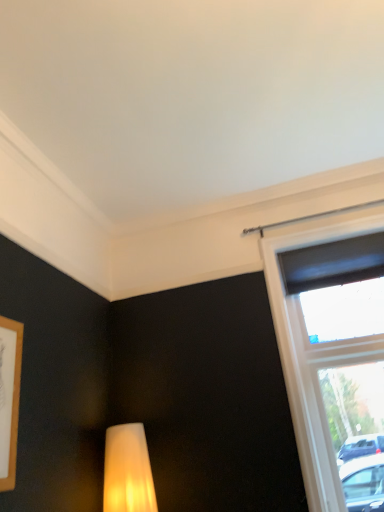
In order to face clear glass window at upper right, should I rotate leftwards or rightwards?

Rotate right and turn 20.908 degrees.

The width and height of the screenshot is (384, 512). What do you see at coordinates (321, 343) in the screenshot?
I see `clear glass window at upper right` at bounding box center [321, 343].

You are a GUI agent. You are given a task and a screenshot of the screen. Output one action in this format:
    pyautogui.click(x=<x>, y=<y>)
    Task: Click on the clear glass window at upper right
    Image resolution: width=384 pixels, height=512 pixels.
    Given the screenshot: What is the action you would take?
    pyautogui.click(x=321, y=343)

Find the location of `clear glass window at upper right`. clear glass window at upper right is located at coordinates [x=321, y=343].